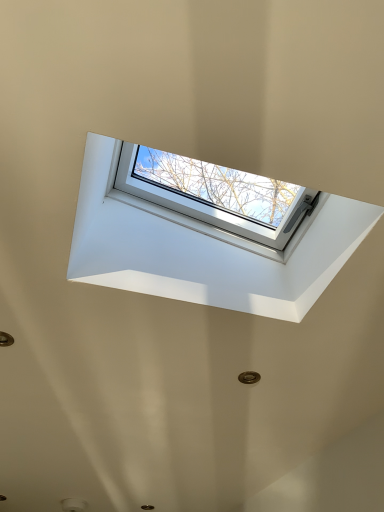
Where is `clear glass window at center`? clear glass window at center is located at coordinates (212, 210).

Image resolution: width=384 pixels, height=512 pixels. What do you see at coordinates (212, 210) in the screenshot?
I see `clear glass window at center` at bounding box center [212, 210].

At what (x,y) coordinates should I click in order to perform the action: click on clear glass window at center. Please return your answer as a coordinate pair (x, y). This screenshot has height=512, width=384. Looking at the image, I should click on (212, 210).